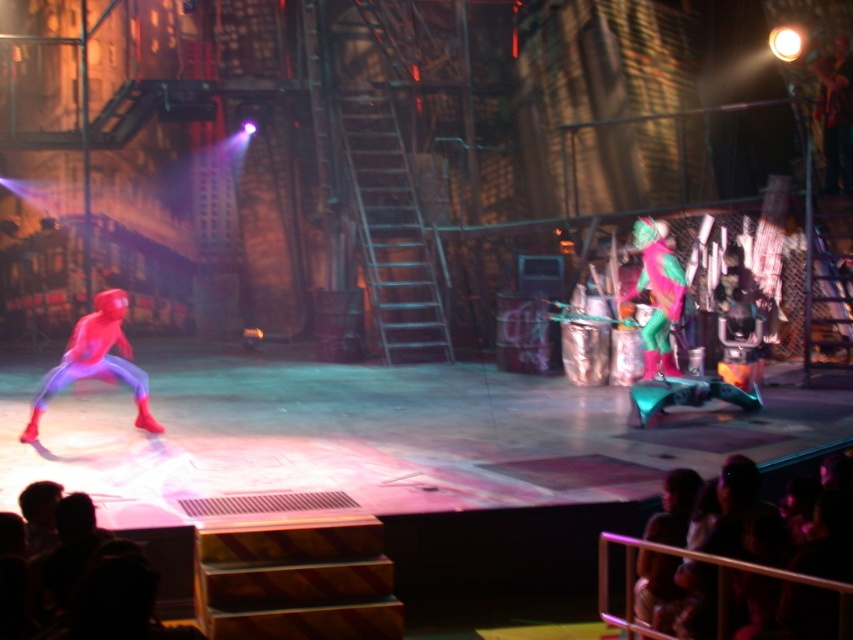
Which is below, shiny red suit at left or neon green fabric costume at center?

shiny red suit at left

Is shiny red suit at left to the left of neon green fabric costume at center from the viewer's perspective?

Indeed, shiny red suit at left is positioned on the left side of neon green fabric costume at center.

Locate an element on the screen. The width and height of the screenshot is (853, 640). shiny red suit at left is located at coordinates tap(96, 362).

The image size is (853, 640). Find the location of `shiny red suit at left`. shiny red suit at left is located at coordinates (96, 362).

Who is positioned more to the right, silky black hair at lower right or shiny red suit at left?

Positioned to the right is silky black hair at lower right.

Does point (813, 486) lie in front of point (123, 307)?

Yes, it is in front of point (123, 307).

Where is `silky black hair at lower right`? Image resolution: width=853 pixels, height=640 pixels. silky black hair at lower right is located at coordinates (744, 518).

Identify the location of silky black hair at lower right. The height and width of the screenshot is (640, 853). (744, 518).

Who is shorter, silky black hair at lower right or neon green fabric costume at center?

With less height is silky black hair at lower right.

Describe the element at coordinates (744, 518) in the screenshot. I see `silky black hair at lower right` at that location.

Where is `silky black hair at lower right`? The height and width of the screenshot is (640, 853). silky black hair at lower right is located at coordinates (744, 518).